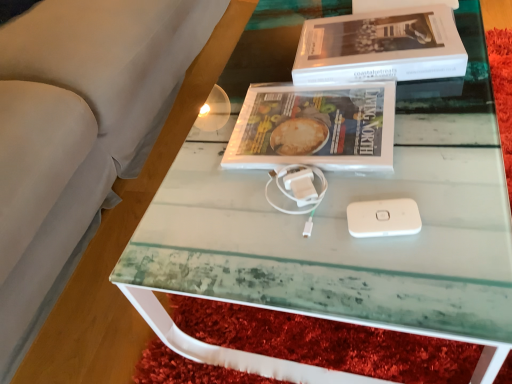
Question: From a real-world perspective, is white matte book at upper center above or below matte plastic magazine at center?

Choices:
 (A) below
 (B) above

Answer: (B)

Question: Does point (389, 64) appear closer or farther from the camera than point (254, 122)?

Choices:
 (A) farther
 (B) closer

Answer: (A)

Question: From the image's perspective, relative to matte plastic magazine at center, is white matte book at upper center above or below?

Choices:
 (A) below
 (B) above

Answer: (B)

Question: Relative to white matte book at upper center, is matte plastic magazine at center in front or behind?

Choices:
 (A) behind
 (B) front

Answer: (B)

Question: Based on their sizes in the image, would you say matte plastic magazine at center is bigger or smaller than white matte book at upper center?

Choices:
 (A) big
 (B) small

Answer: (B)

Question: Looking at their shapes, would you say matte plastic magazine at center is wider or thinner than white matte book at upper center?

Choices:
 (A) thin
 (B) wide

Answer: (A)

Question: From the image's perspective, is matte plastic magazine at center positioned above or below white matte book at upper center?

Choices:
 (A) above
 (B) below

Answer: (B)